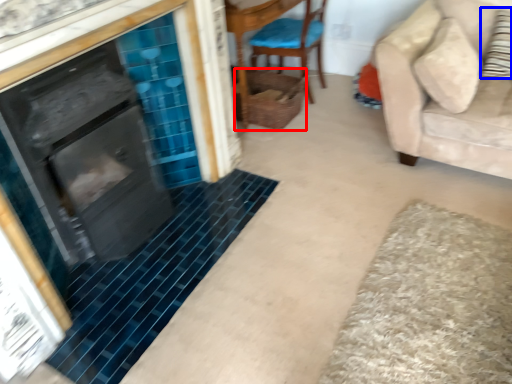
Question: Which point is further to the camera, basket (highlighted by a red box) or pillow (highlighted by a blue box)?

Choices:
 (A) basket
 (B) pillow

Answer: (A)